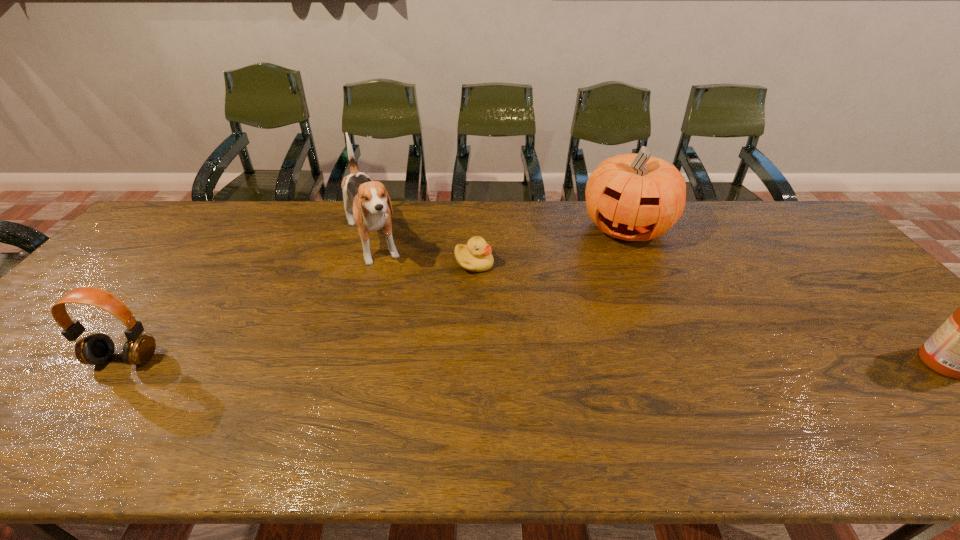
Locate an element on the screen. This screenshot has width=960, height=540. vacant space located 0.050m on the front-facing side of the second object from right to left is located at coordinates (614, 262).

I want to click on free spot located on the front-facing side of the second object from right to left, so click(x=607, y=285).

At what (x,y) coordinates should I click in order to perform the action: click on free location located 0.170m on the front-facing side of the second object from right to left. Please return your answer as a coordinate pair (x, y). Looking at the image, I should click on (606, 287).

Where is `free space located 0.070m at the face of the second object from left to right`? Image resolution: width=960 pixels, height=540 pixels. free space located 0.070m at the face of the second object from left to right is located at coordinates (384, 291).

Where is `vacant space situated at the face of the second object from left to right`? This screenshot has width=960, height=540. vacant space situated at the face of the second object from left to right is located at coordinates (405, 338).

At what (x,y) coordinates should I click in order to perform the action: click on free region located at the face of the second object from left to right. Please return your answer as a coordinate pair (x, y). The image size is (960, 540). Looking at the image, I should click on (394, 312).

Locate an element on the screen. pumpkin situated at the far edge is located at coordinates (635, 197).

Where is `puppy positioned at the far edge`? This screenshot has width=960, height=540. puppy positioned at the far edge is located at coordinates (368, 198).

At what (x,y) coordinates should I click in order to perform the action: click on free region at the far edge. Please return your answer as a coordinate pair (x, y). Looking at the image, I should click on (467, 206).

You are a GUI agent. You are given a task and a screenshot of the screen. Output one action in this format:
    pyautogui.click(x=<x>, y=<y>)
    Task: Click on the vacant region at the near edge of the desktop
    
    Given the screenshot: What is the action you would take?
    pyautogui.click(x=713, y=395)